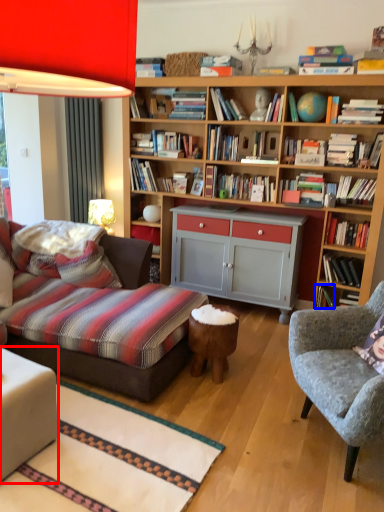
Question: Which point is further to the camera, table (highlighted by a red box) or book (highlighted by a blue box)?

Choices:
 (A) table
 (B) book

Answer: (B)